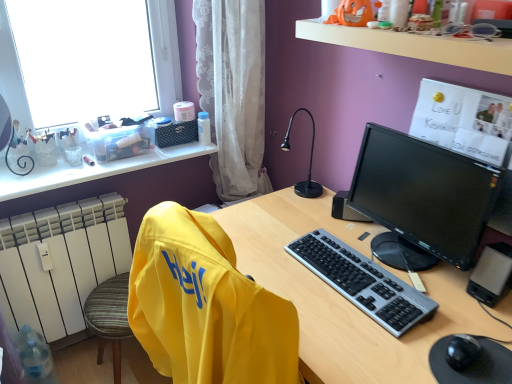
Where is `vacant area that lies between black rubber mouse at lower right and black plastic speaker at right`? vacant area that lies between black rubber mouse at lower right and black plastic speaker at right is located at coordinates (395, 264).